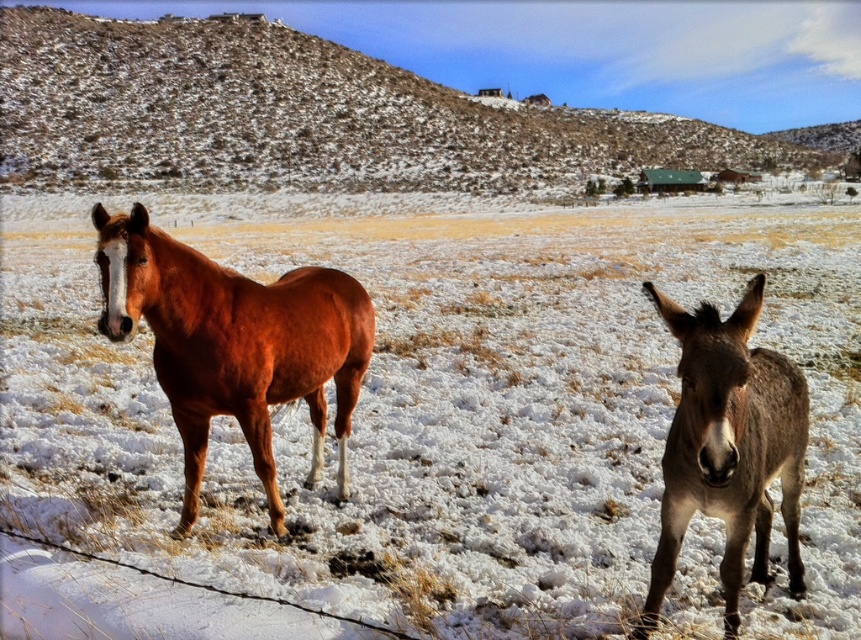
How far apart are brown glossy horse at left and gray rough fur donkey at right?

The distance of brown glossy horse at left from gray rough fur donkey at right is 7.47 feet.

Does brown glossy horse at left appear over gray rough fur donkey at right?

Yes.

The height and width of the screenshot is (640, 861). What do you see at coordinates (234, 344) in the screenshot? I see `brown glossy horse at left` at bounding box center [234, 344].

I want to click on brown glossy horse at left, so click(234, 344).